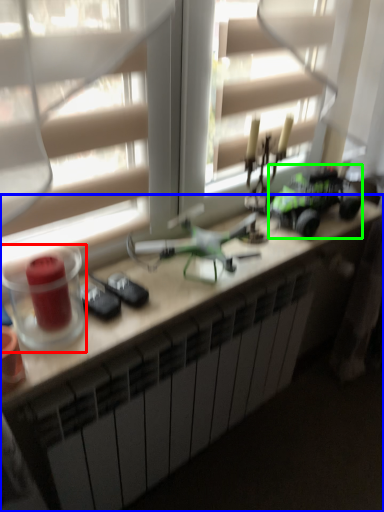
Question: Which is nearer to the candle holder (highlighted by a red box)? desk (highlighted by a blue box) or model car (highlighted by a green box).

Choices:
 (A) desk
 (B) model car

Answer: (A)